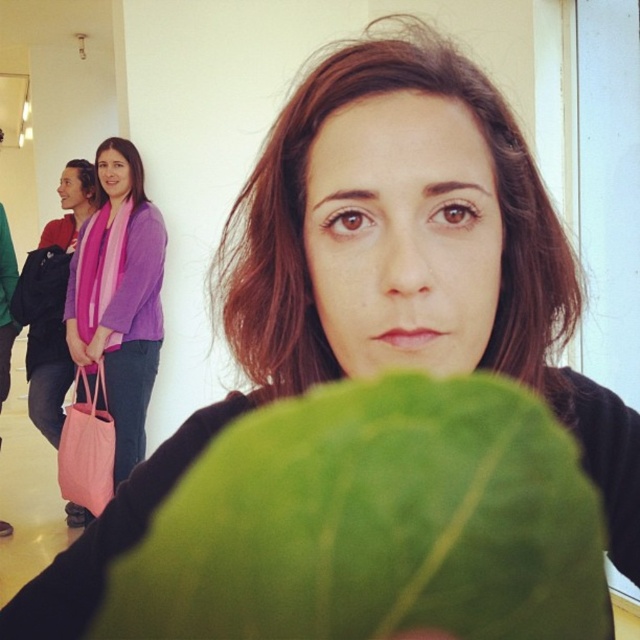
Question: Which point is farther to the camera?

Choices:
 (A) (481, 435)
 (B) (74, 304)
 (C) (1, 321)

Answer: (C)

Question: Where is green matte leaf at center located in relation to pink fabric bag at left in the image?

Choices:
 (A) right
 (B) left

Answer: (A)

Question: Is the position of green matte leaf at center more distant than that of pink fabric scarf at upper left?

Choices:
 (A) yes
 (B) no

Answer: (B)

Question: Is green matte leaf at center wider than pink fabric bag at left?

Choices:
 (A) yes
 (B) no

Answer: (A)

Question: Which object is closer to the camera taking this photo?

Choices:
 (A) pink fabric scarf at upper left
 (B) pink fabric bag at left
 (C) green matte leaf at center

Answer: (C)

Question: Which of these objects is positioned farthest from the green matte leaf at center?

Choices:
 (A) pink fabric bag at left
 (B) pink fabric scarf at upper left

Answer: (A)